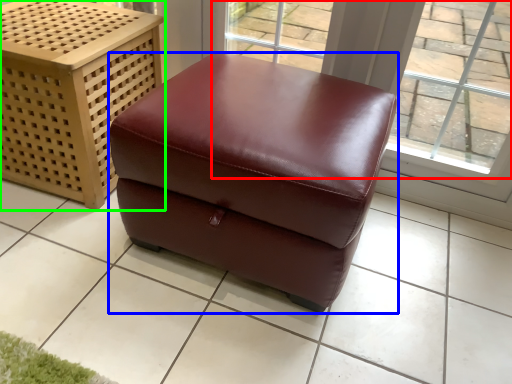
Question: Estimate the real-world distances between objects in this image. Which object is closer to window (highlighted by a red box), furniture (highlighted by a blue box) or furniture (highlighted by a green box)?

Choices:
 (A) furniture
 (B) furniture

Answer: (A)